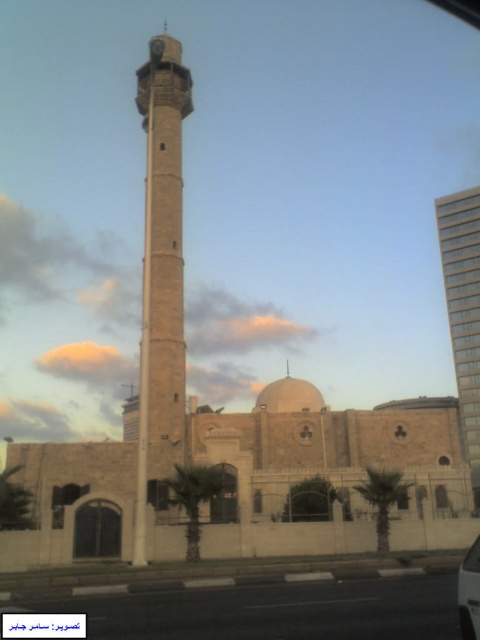
You are standing in front of the mosque and notice both the beige stone minaret at center and the metallic silver car at center. Which object has a narrower width?

The beige stone minaret at center is thinner than the metallic silver car at center, so the beige stone minaret at center has a narrower width.